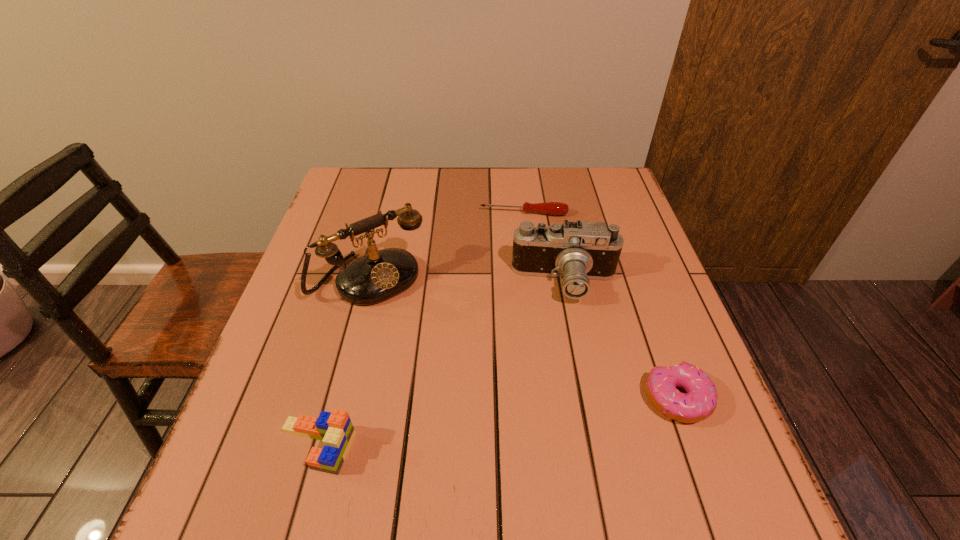
Where is `Lego that is at the left edge`? This screenshot has width=960, height=540. Lego that is at the left edge is located at coordinates (335, 430).

What are the coordinates of `telephone that is at the left edge` in the screenshot? It's located at (379, 275).

You are a GUI agent. You are given a task and a screenshot of the screen. Output one action in this format:
    pyautogui.click(x=<x>, y=<y>)
    Task: Click on the doughnut located at the right edge
    
    Given the screenshot: What is the action you would take?
    pyautogui.click(x=699, y=402)

Where is `camera located at the right edge`? Image resolution: width=960 pixels, height=540 pixels. camera located at the right edge is located at coordinates (578, 251).

Where is `object that is at the near left corner`? Image resolution: width=960 pixels, height=540 pixels. object that is at the near left corner is located at coordinates (335, 430).

The height and width of the screenshot is (540, 960). I want to click on object that is at the near right corner, so click(x=699, y=402).

In order to click on vacant area at the far edge of the desktop in this screenshot , I will do `click(492, 173)`.

Find the location of `free spot at the near edge of the desktop`. free spot at the near edge of the desktop is located at coordinates (480, 453).

In the image, there is a desktop. At what (x,y) coordinates should I click in order to perform the action: click on free space at the right edge. Please return your answer as a coordinate pair (x, y). Looking at the image, I should click on (610, 219).

This screenshot has height=540, width=960. In the image, there is a desktop. What are the coordinates of `vacant space at the far left corner` in the screenshot? It's located at click(x=338, y=183).